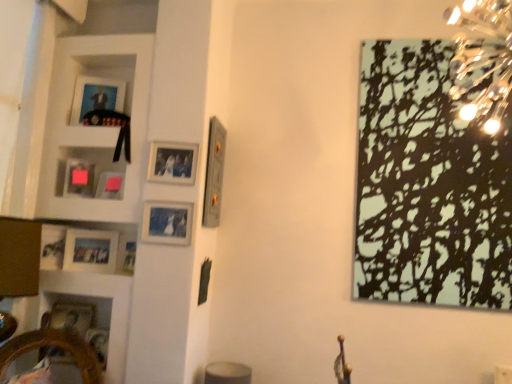
Question: Can you confirm if black matte picture frame at upper right, marked as the 1th picture frame in a right-to-left arrangement, is smaller than matte silver picture frame at upper center, the eighth picture frame positioned from the left?

Choices:
 (A) no
 (B) yes

Answer: (A)

Question: Is black matte picture frame at upper right, arranged as the 10th picture frame when viewed from the left, next to matte silver picture frame at upper center, the eighth picture frame positioned from the left?

Choices:
 (A) no
 (B) yes

Answer: (A)

Question: From the image's perspective, is black matte picture frame at upper right, arranged as the 10th picture frame when viewed from the left, on top of matte silver picture frame at upper center, positioned as the third picture frame in right-to-left order?

Choices:
 (A) yes
 (B) no

Answer: (B)

Question: Does black matte picture frame at upper right, marked as the 1th picture frame in a right-to-left arrangement, come behind matte silver picture frame at upper center, positioned as the third picture frame in right-to-left order?

Choices:
 (A) yes
 (B) no

Answer: (B)

Question: Considering the relative sizes of black matte picture frame at upper right, marked as the 1th picture frame in a right-to-left arrangement, and matte silver picture frame at upper center, the eighth picture frame positioned from the left, in the image provided, is black matte picture frame at upper right, marked as the 1th picture frame in a right-to-left arrangement, bigger than matte silver picture frame at upper center, the eighth picture frame positioned from the left,?

Choices:
 (A) no
 (B) yes

Answer: (B)

Question: Considering the positions of white glossy cabinet at upper left and matte glass picture frame at center-left, the seventh picture frame when ordered from left to right, in the image, is white glossy cabinet at upper left bigger or smaller than matte glass picture frame at center-left, the seventh picture frame when ordered from left to right,?

Choices:
 (A) small
 (B) big

Answer: (B)

Question: Considering the relative positions of white glossy cabinet at upper left and matte glass picture frame at center-left, which appears as the fourth picture frame when viewed from the right, in the image provided, is white glossy cabinet at upper left to the left or to the right of matte glass picture frame at center-left, which appears as the fourth picture frame when viewed from the right,?

Choices:
 (A) right
 (B) left

Answer: (B)

Question: Looking at their shapes, would you say white glossy cabinet at upper left is wider or thinner than matte glass picture frame at center-left, the seventh picture frame when ordered from left to right?

Choices:
 (A) wide
 (B) thin

Answer: (A)

Question: From the image's perspective, is white glossy cabinet at upper left above or below matte glass picture frame at center-left, which appears as the fourth picture frame when viewed from the right?

Choices:
 (A) above
 (B) below

Answer: (A)

Question: Is point (108, 248) positioned closer to the camera than point (159, 152)?

Choices:
 (A) farther
 (B) closer

Answer: (A)

Question: Considering the relative positions of matte wooden picture frame at left, the fourth picture frame viewed from the left, and matte silver picture frame at upper center, positioned as the third picture frame in right-to-left order, in the image provided, is matte wooden picture frame at left, the fourth picture frame viewed from the left, to the left or to the right of matte silver picture frame at upper center, positioned as the third picture frame in right-to-left order,?

Choices:
 (A) left
 (B) right

Answer: (A)

Question: Which is correct: matte wooden picture frame at left, the fourth picture frame viewed from the left, is inside matte silver picture frame at upper center, the eighth picture frame positioned from the left, or outside of it?

Choices:
 (A) inside
 (B) outside

Answer: (B)

Question: From the image's perspective, is matte wooden picture frame at left, the fourth picture frame viewed from the left, located above or below matte silver picture frame at upper center, positioned as the third picture frame in right-to-left order?

Choices:
 (A) above
 (B) below

Answer: (B)

Question: From the image's perspective, is matte glass picture frame at center-left, the seventh picture frame when ordered from left to right, positioned above or below matte pink picture frame at upper left, which is the second picture frame from left to right?

Choices:
 (A) above
 (B) below

Answer: (B)

Question: From a real-world perspective, is matte glass picture frame at center-left, the seventh picture frame when ordered from left to right, positioned above or below matte pink picture frame at upper left, which is the second picture frame from left to right?

Choices:
 (A) above
 (B) below

Answer: (B)